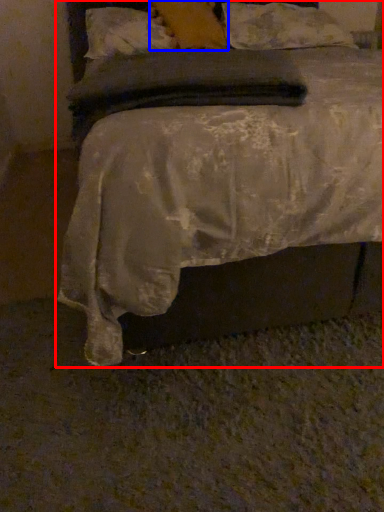
Question: Which point is closer to the camera, bed (highlighted by a red box) or pillow (highlighted by a blue box)?

Choices:
 (A) bed
 (B) pillow

Answer: (A)